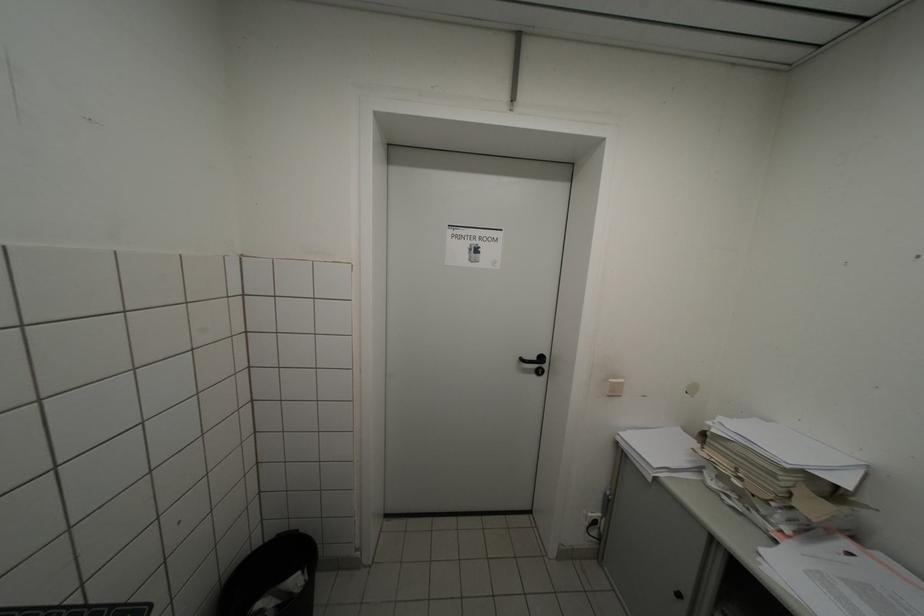
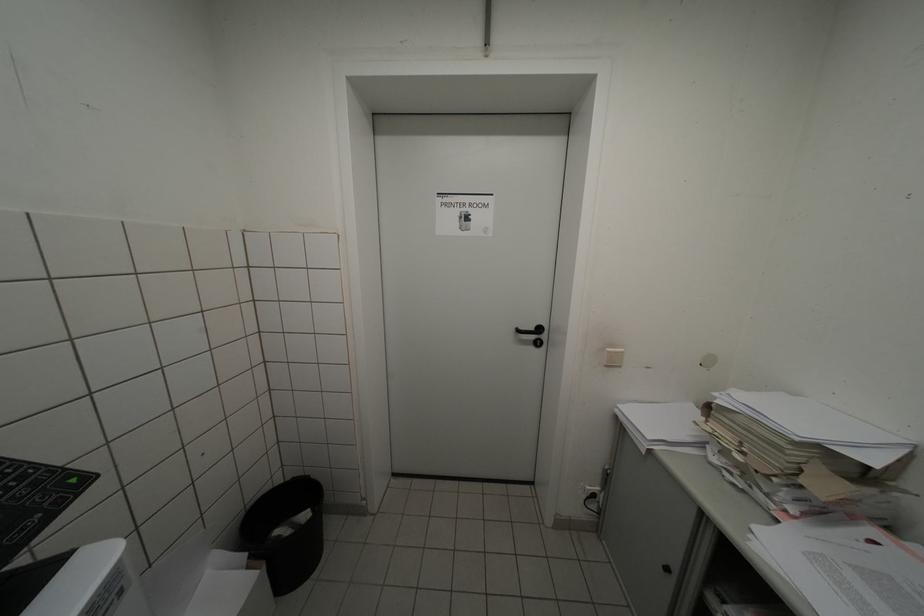
Locate, in the second image, the point that corresponds to pixel 618 383 in the first image.

(615, 352)